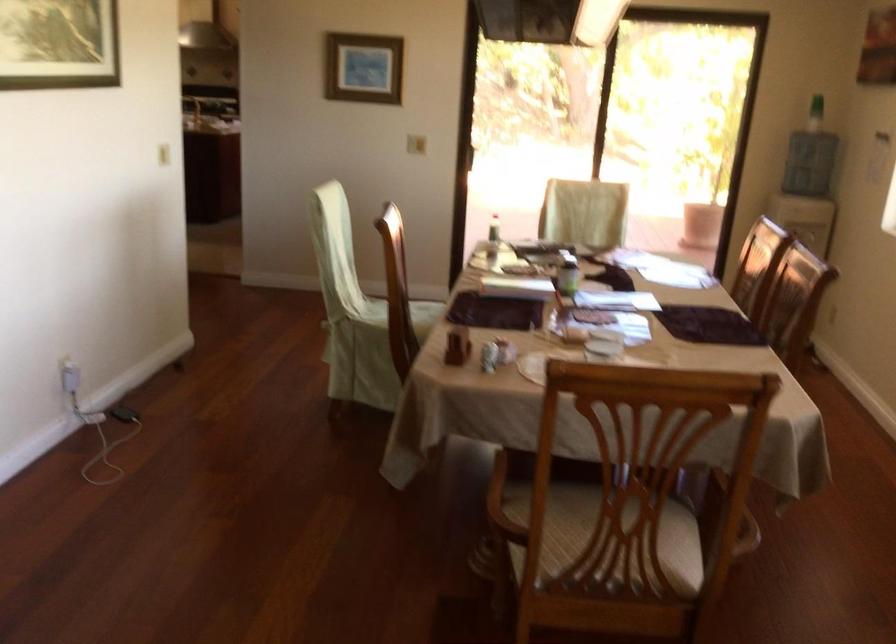
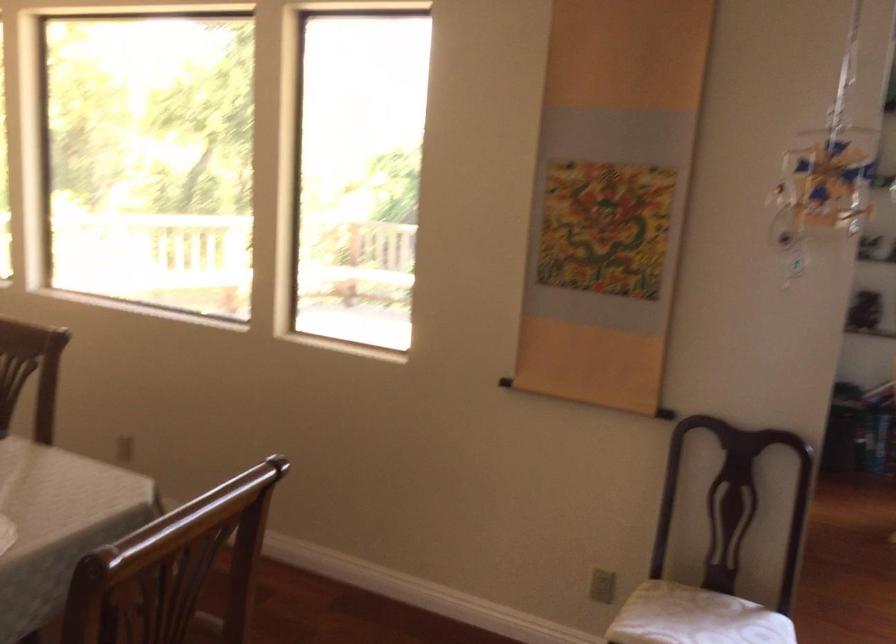
Question: The first image is from the beginning of the video and the second image is from the end. How did the camera likely rotate when shooting the video?

Choices:
 (A) Left
 (B) Right
 (C) Up
 (D) Down

Answer: (B)